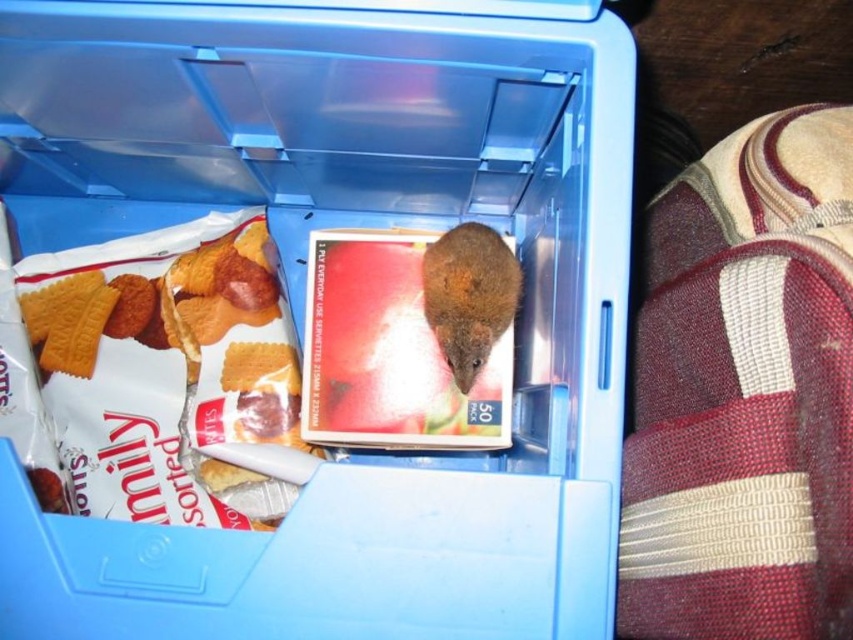
You are organizing items in a container and need to stack the matte white biscuit packet at left and the brown furry mouse at center. Which item should you place at the bottom to ensure stability?

The matte white biscuit packet at left should be placed at the bottom because it has a greater height than the brown furry mouse at center, providing a more stable base.